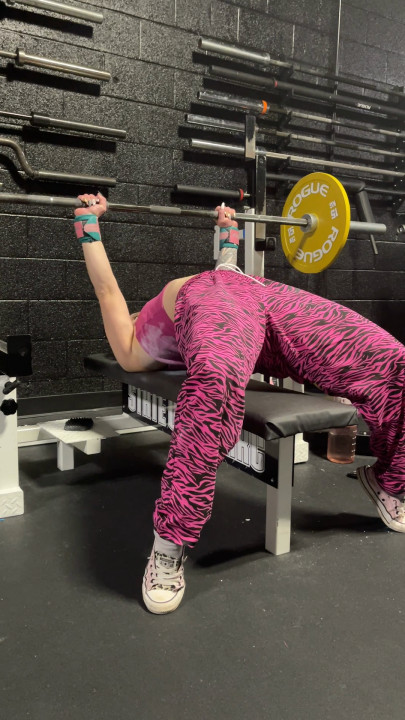
Where is `floor`? The width and height of the screenshot is (405, 720). floor is located at coordinates (299, 692).